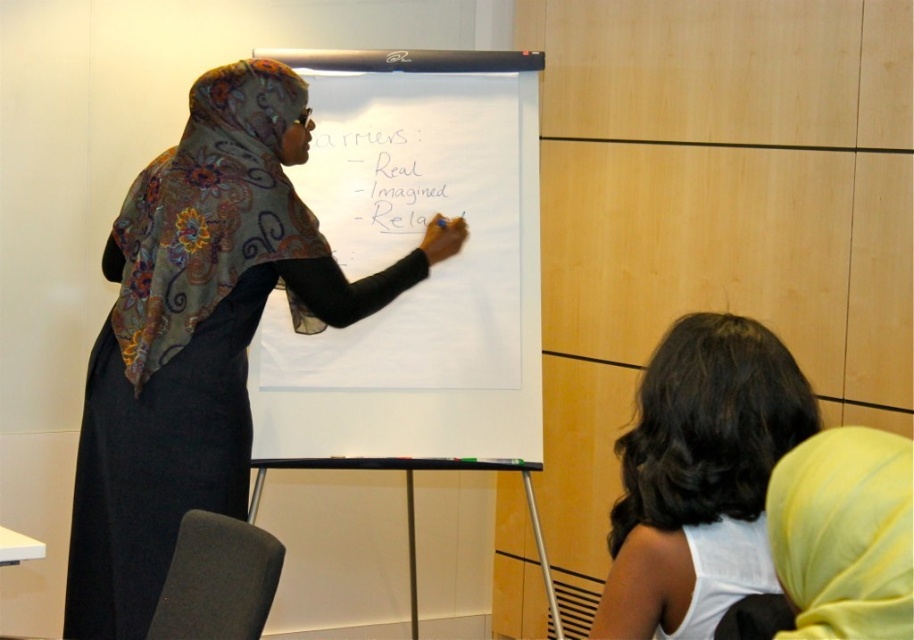
You are a photographer trying to capture a closeup of the matte floral hijab at center and dark brown hair at lower right. Which object should you zoom in on to ensure both are in frame without moving the camera?

The matte floral hijab at center is wider than dark brown hair at lower right, so you should zoom in on the matte floral hijab at center to ensure both are in frame without moving the camera.

You are a person with a 18 inch wide backpack. You need to walk through the space between the whiteboard at center and the matte floral hijab at center. Can your backpack fit through the space?

The distance between the whiteboard at center and the matte floral hijab at center is 20.11 inches. Since your backpack is 18 inches wide, it can fit through the space as the distance is wider than the backpack.

You are a person with a height of 1.6 meters standing at the dark brown hair at lower right position. You want to reach the matte floral hijab at center. Can you reach it without moving your feet?

The distance between matte floral hijab at center and dark brown hair at lower right is 1.21 meters. Since the average arm reach for a person of 1.6 meters is about 1.2 meters, you might barely be able to reach it but it would be difficult.